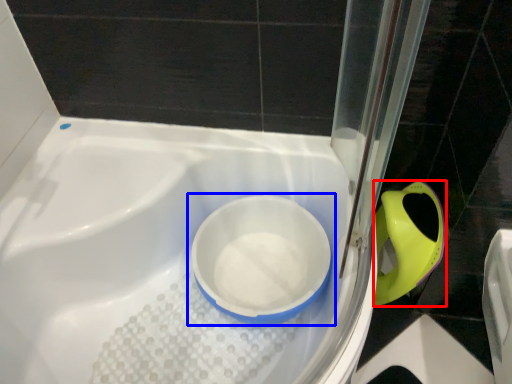
Question: Which point is further to the camera, bidet (highlighted by a red box) or toilet (highlighted by a blue box)?

Choices:
 (A) bidet
 (B) toilet

Answer: (A)